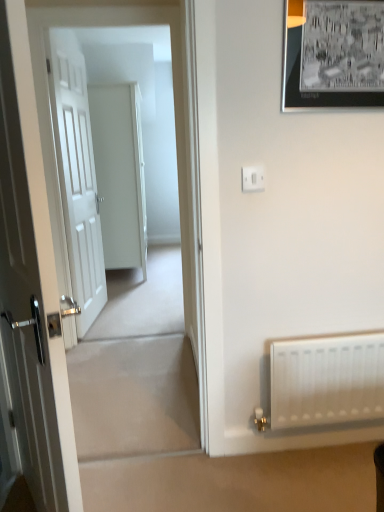
Question: Can you confirm if white matte radiator at lower right is smaller than white matte door at left, which appears as the first door when viewed from the front?

Choices:
 (A) no
 (B) yes

Answer: (B)

Question: Is white matte radiator at lower right facing away from white matte door at left, which appears as the first door when viewed from the front?

Choices:
 (A) no
 (B) yes

Answer: (A)

Question: Is white matte radiator at lower right outside white matte door at left, which appears as the first door when viewed from the front?

Choices:
 (A) yes
 (B) no

Answer: (A)

Question: From a real-world perspective, is white matte radiator at lower right positioned over white matte door at left, which appears as the first door when viewed from the front, based on gravity?

Choices:
 (A) yes
 (B) no

Answer: (B)

Question: Is white matte radiator at lower right at the right side of white matte door at left, acting as the 3th door starting from the back?

Choices:
 (A) no
 (B) yes

Answer: (B)

Question: From the image's perspective, relative to white plastic switch at upper center, is white glossy door at center, which appears as the 3th door when viewed from the front, above or below?

Choices:
 (A) below
 (B) above

Answer: (B)

Question: Looking at their shapes, would you say white glossy door at center, marked as the first door in a back-to-front arrangement, is wider or thinner than white plastic switch at upper center?

Choices:
 (A) wide
 (B) thin

Answer: (A)

Question: Is point (94, 93) positioned closer to the camera than point (251, 168)?

Choices:
 (A) closer
 (B) farther

Answer: (B)

Question: Is white glossy door at center, marked as the first door in a back-to-front arrangement, bigger or smaller than white plastic switch at upper center?

Choices:
 (A) big
 (B) small

Answer: (A)

Question: From their relative heights in the image, would you say black matte picture frame at upper right is taller or shorter than white wooden door at left, arranged as the second door when viewed from the back?

Choices:
 (A) short
 (B) tall

Answer: (A)

Question: Is black matte picture frame at upper right wider or thinner than white wooden door at left, the 2th door when ordered from front to back?

Choices:
 (A) thin
 (B) wide

Answer: (A)

Question: Looking at the image, does black matte picture frame at upper right seem bigger or smaller compared to white wooden door at left, the 2th door when ordered from front to back?

Choices:
 (A) big
 (B) small

Answer: (B)

Question: Is black matte picture frame at upper right in front of or behind white wooden door at left, the 2th door when ordered from front to back, in the image?

Choices:
 (A) front
 (B) behind

Answer: (A)

Question: Is point [x=251, y=169] closer or farther from the camera than point [x=23, y=458]?

Choices:
 (A) closer
 (B) farther

Answer: (A)

Question: In terms of width, does white plastic switch at upper center look wider or thinner when compared to white matte door at left, which appears as the first door when viewed from the front?

Choices:
 (A) thin
 (B) wide

Answer: (A)